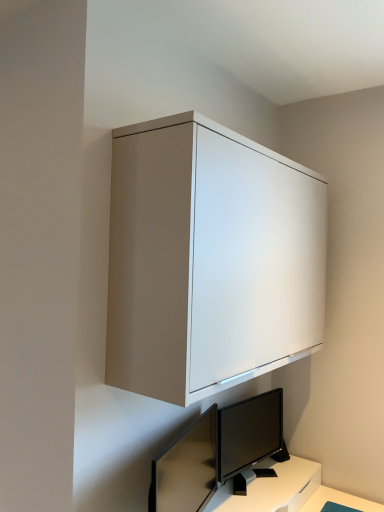
Question: Can you confirm if black glossy monitor at lower center, the first computer monitor from the right, is bigger than matte white cabinet at upper center?

Choices:
 (A) yes
 (B) no

Answer: (B)

Question: Can you confirm if black glossy monitor at lower center, which is the second computer monitor in left-to-right order, is smaller than matte white cabinet at upper center?

Choices:
 (A) yes
 (B) no

Answer: (A)

Question: From a real-world perspective, is black glossy monitor at lower center, which is the second computer monitor in left-to-right order, positioned over matte white cabinet at upper center based on gravity?

Choices:
 (A) no
 (B) yes

Answer: (A)

Question: From a real-world perspective, is black glossy monitor at lower center, which is the second computer monitor in left-to-right order, under matte white cabinet at upper center?

Choices:
 (A) no
 (B) yes

Answer: (B)

Question: Does black glossy monitor at lower center, the first computer monitor from the right, appear on the left side of matte white cabinet at upper center?

Choices:
 (A) yes
 (B) no

Answer: (B)

Question: Does black glossy monitor at lower center, which is the 1th computer monitor from back to front, come in front of matte white cabinet at upper center?

Choices:
 (A) yes
 (B) no

Answer: (B)

Question: Is matte white cabinet at upper center at the left side of matte black monitor at lower center, which is the second computer monitor in back-to-front order?

Choices:
 (A) no
 (B) yes

Answer: (A)

Question: Is matte black monitor at lower center, the 1th computer monitor positioned from the front, located within matte white cabinet at upper center?

Choices:
 (A) yes
 (B) no

Answer: (B)

Question: Can you confirm if matte white cabinet at upper center is thinner than matte black monitor at lower center, which is the second computer monitor in back-to-front order?

Choices:
 (A) no
 (B) yes

Answer: (A)

Question: Is matte white cabinet at upper center aimed at matte black monitor at lower center, the 1th computer monitor positioned from the front?

Choices:
 (A) yes
 (B) no

Answer: (B)

Question: Are matte white cabinet at upper center and matte black monitor at lower center, which is the 2th computer monitor from right to left, beside each other?

Choices:
 (A) yes
 (B) no

Answer: (B)

Question: From the image's perspective, is matte white cabinet at upper center below matte black monitor at lower center, the 1th computer monitor positioned from the front?

Choices:
 (A) yes
 (B) no

Answer: (B)

Question: Does matte black monitor at lower center, which is the first computer monitor in left-to-right order, have a larger size compared to matte white cabinet at upper center?

Choices:
 (A) yes
 (B) no

Answer: (B)